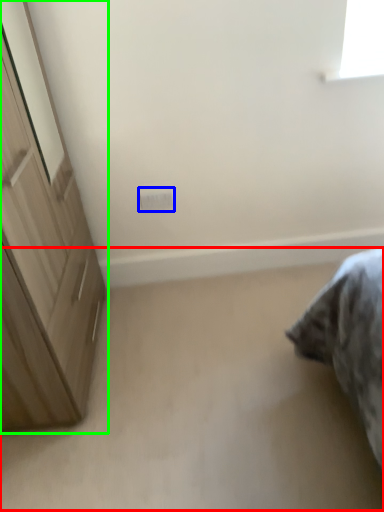
Question: Which is nearer to the plain (highlighted by a red box)? electric outlet (highlighted by a blue box) or cupboard (highlighted by a green box).

Choices:
 (A) electric outlet
 (B) cupboard

Answer: (B)